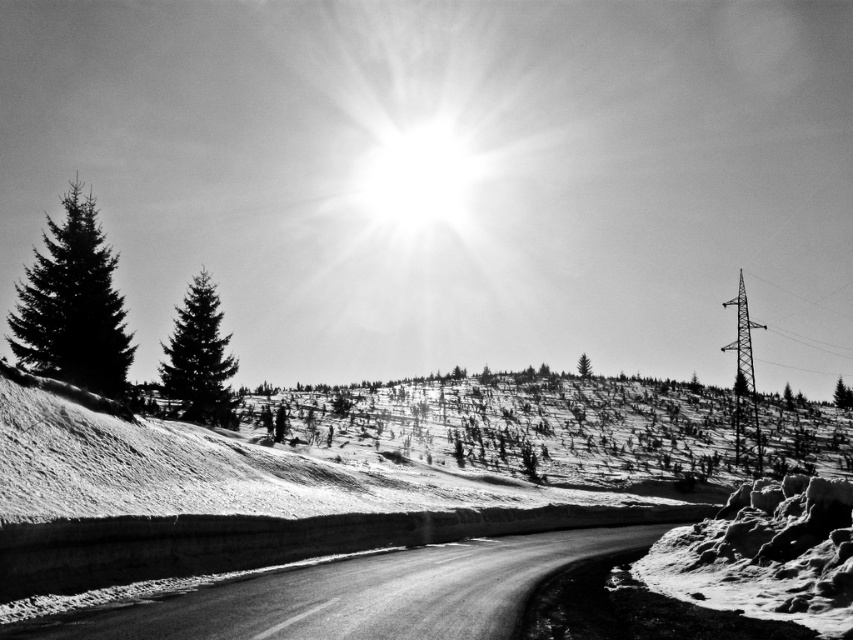
Question: Which point is farther to the camera?

Choices:
 (A) dark green textured pine tree at upper left
 (B) dark green textured pine tree at left

Answer: (A)

Question: Which point appears farthest from the camera in this image?

Choices:
 (A) (579, 360)
 (B) (846, 394)
 (C) (184, 417)

Answer: (A)

Question: Is silvery textured pine tree at left bigger than dark green textured pine tree at upper left?

Choices:
 (A) no
 (B) yes

Answer: (B)

Question: Does smooth asphalt road at center have a larger size compared to silvery textured pine tree at left?

Choices:
 (A) yes
 (B) no

Answer: (B)

Question: Is smooth asphalt road at center smaller than dark green textured pine tree at upper left?

Choices:
 (A) no
 (B) yes

Answer: (B)

Question: Among these points, which one is farthest from the camera?

Choices:
 (A) (372, 632)
 (B) (186, 294)
 (C) (584, 369)
 (D) (55, 308)

Answer: (C)